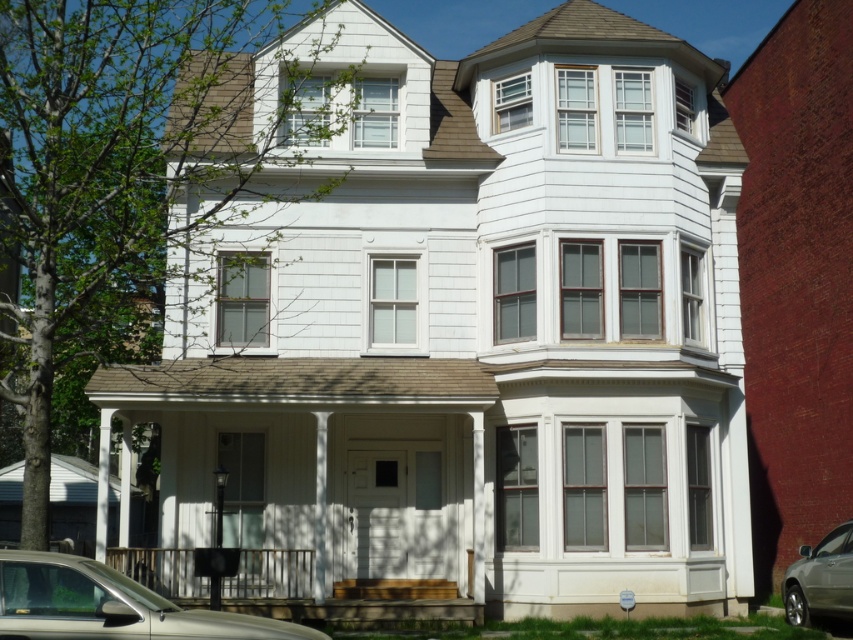
You are a delivery person trying to park your metallic silver car at lower left and silver metallic sedan at lower right in the driveway in front of the house. The driveway can only accommodate vehicles of a certain width. Based on their sizes, which vehicle would require more space to park?

The metallic silver car at lower left requires more space to park because its width is larger than the silver metallic sedan at lower right.

You are standing in front of the house and see the metallic silver car at lower left and the silver metallic sedan at lower right. Which car is closer to you?

The metallic silver car at lower left is closer to you because it is positioned in front of the silver metallic sedan at lower right.

You are a delivery driver approaching the house and need to park your vehicle. The driveway is narrow and can only accommodate one car at a time. You see the metallic silver car at lower left and the silver metallic sedan at lower right parked on either side of the driveway entrance. Which vehicle should you avoid parking next to to ensure there is enough space for your truck?

You should avoid parking next to the metallic silver car at lower left because it is larger in size compared to the silver metallic sedan at lower right, leaving less space for your truck.